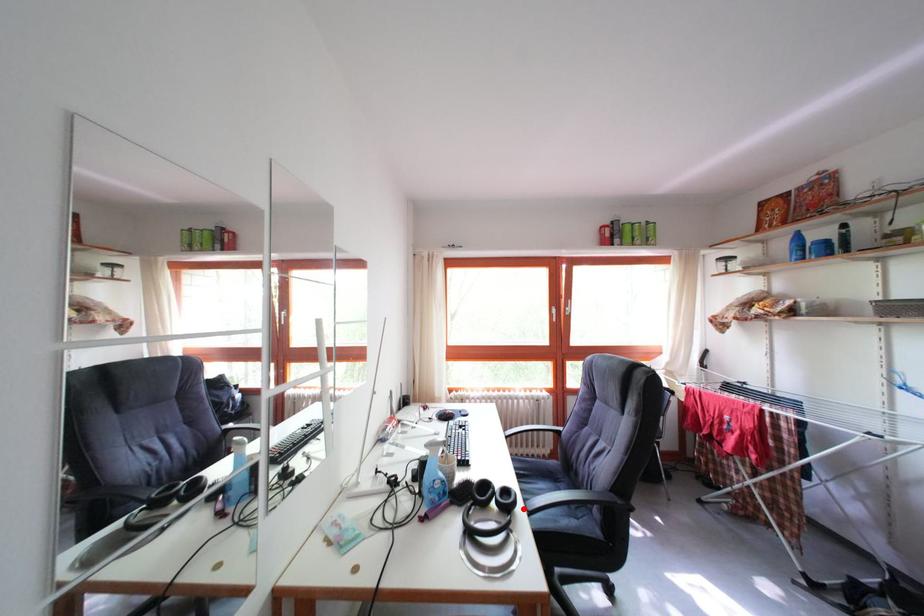
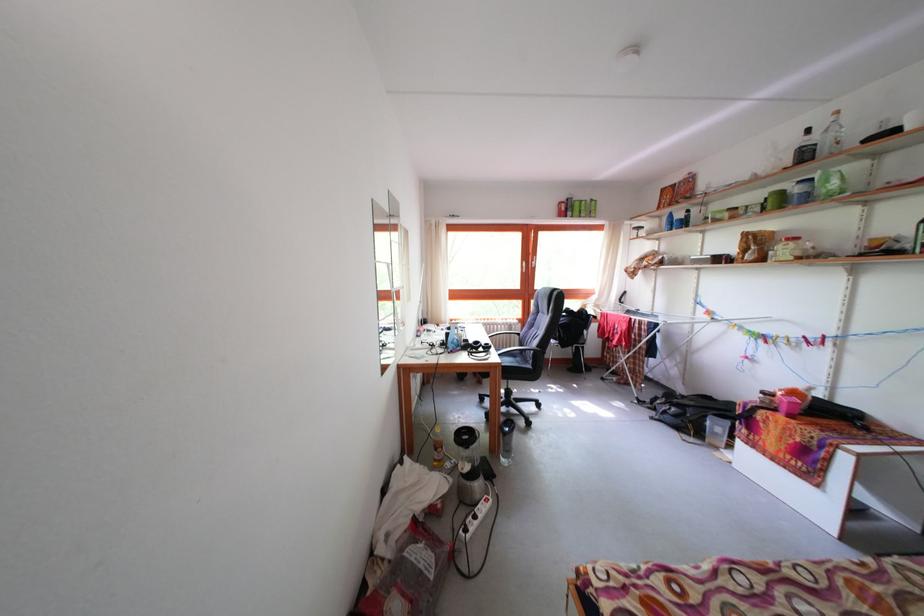
Question: I am providing you with two images of the same scene from different viewpoints. Image1 has a red point marked. In image2, the corresponding 3D location appears at what relative position? Reply with the corresponding letter.

Choices:
 (A) Closer
 (B) Farther

Answer: (B)